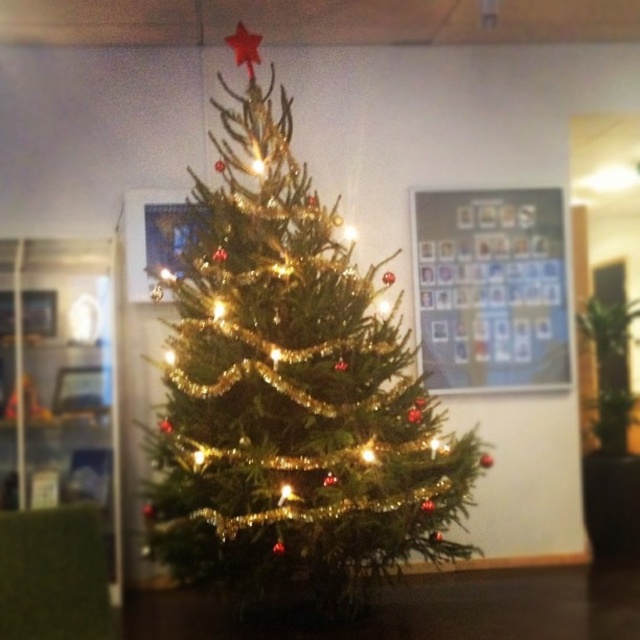
Question: Is green shiny christmas tree at center bigger than metallic red star at top?

Choices:
 (A) yes
 (B) no

Answer: (A)

Question: Which object appears farthest from the camera in this image?

Choices:
 (A) green shiny christmas tree at center
 (B) metallic red star at top

Answer: (B)

Question: Is green shiny christmas tree at center wider than metallic silver frame at upper center?

Choices:
 (A) yes
 (B) no

Answer: (A)

Question: Which object is the closest to the metallic red star at top?

Choices:
 (A) metallic silver frame at upper center
 (B) green shiny christmas tree at center

Answer: (B)

Question: Which point appears farthest from the camera in this image?

Choices:
 (A) (451, 288)
 (B) (230, 42)

Answer: (A)

Question: Is the position of green shiny christmas tree at center less distant than that of metallic red star at top?

Choices:
 (A) yes
 (B) no

Answer: (A)